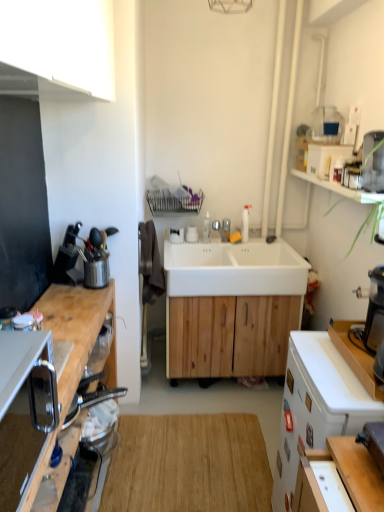
Question: Should I look upward or downward to see white matte desk at right?

Choices:
 (A) up
 (B) down

Answer: (B)

Question: Is satin silver phone at left a part of white wood cabinet at center?

Choices:
 (A) yes
 (B) no

Answer: (B)

Question: Considering the relative sizes of white wood cabinet at center and satin silver phone at left in the image provided, is white wood cabinet at center smaller than satin silver phone at left?

Choices:
 (A) yes
 (B) no

Answer: (B)

Question: Is white wood cabinet at center positioned in front of satin silver phone at left?

Choices:
 (A) no
 (B) yes

Answer: (A)

Question: From a real-world perspective, does white wood cabinet at center sit lower than satin silver phone at left?

Choices:
 (A) no
 (B) yes

Answer: (B)

Question: Is white wood cabinet at center taller than satin silver phone at left?

Choices:
 (A) no
 (B) yes

Answer: (B)

Question: Are white wood cabinet at center and satin silver phone at left far apart?

Choices:
 (A) no
 (B) yes

Answer: (B)

Question: Can you confirm if natural wood cutting board at center is wider than white glossy faucet at center?

Choices:
 (A) no
 (B) yes

Answer: (B)

Question: Is natural wood cutting board at center completely or partially outside of white glossy faucet at center?

Choices:
 (A) no
 (B) yes

Answer: (B)

Question: Does natural wood cutting board at center have a smaller size compared to white glossy faucet at center?

Choices:
 (A) no
 (B) yes

Answer: (A)

Question: Is natural wood cutting board at center to the right of white glossy faucet at center from the viewer's perspective?

Choices:
 (A) yes
 (B) no

Answer: (B)

Question: From a real-world perspective, is natural wood cutting board at center on top of white glossy faucet at center?

Choices:
 (A) yes
 (B) no

Answer: (B)

Question: Does natural wood cutting board at center have a greater height compared to white glossy faucet at center?

Choices:
 (A) no
 (B) yes

Answer: (A)

Question: Does white matte cabinet at upper left, arranged as the 1th cabinetry when viewed from the top, come behind natural wood cutting board at center?

Choices:
 (A) no
 (B) yes

Answer: (A)